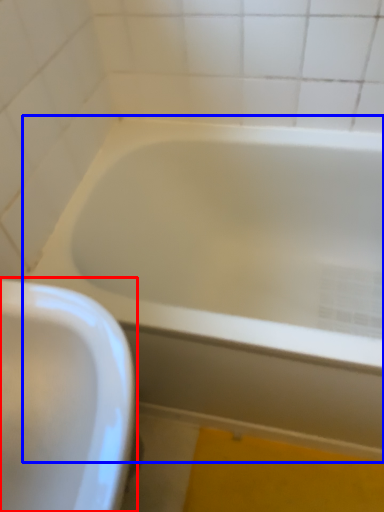
Question: Which object is closer to the camera taking this photo, sink (highlighted by a red box) or bathtub (highlighted by a blue box)?

Choices:
 (A) sink
 (B) bathtub

Answer: (A)